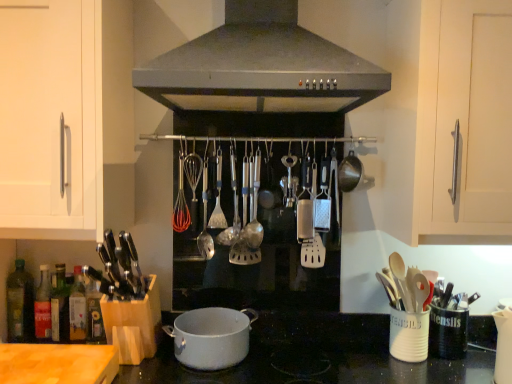
Question: Is silver metallic spoon at center, the third utensil viewed from the right, next to white ceramic utensil holder at lower right and touching it?

Choices:
 (A) yes
 (B) no

Answer: (B)

Question: Does silver metallic spoon at center, which appears as the first utensil when viewed from the left, come behind white ceramic utensil holder at lower right?

Choices:
 (A) yes
 (B) no

Answer: (A)

Question: Is silver metallic spoon at center, the third utensil viewed from the right, thinner than white ceramic utensil holder at lower right?

Choices:
 (A) no
 (B) yes

Answer: (B)

Question: Is silver metallic spoon at center, which appears as the first utensil when viewed from the left, looking in the opposite direction of white ceramic utensil holder at lower right?

Choices:
 (A) yes
 (B) no

Answer: (B)

Question: Is the depth of silver metallic spoon at center, the third utensil viewed from the right, less than that of white ceramic utensil holder at lower right?

Choices:
 (A) yes
 (B) no

Answer: (B)

Question: From a real-world perspective, is white ceramic utensil holder at lower right physically located above or below green glass bottle at lower left?

Choices:
 (A) above
 (B) below

Answer: (B)

Question: Choose the correct answer: Is white ceramic utensil holder at lower right inside green glass bottle at lower left or outside it?

Choices:
 (A) inside
 (B) outside

Answer: (B)

Question: In the image, is white ceramic utensil holder at lower right positioned in front of or behind green glass bottle at lower left?

Choices:
 (A) behind
 (B) front

Answer: (B)

Question: From the image's perspective, is white ceramic utensil holder at lower right above or below green glass bottle at lower left?

Choices:
 (A) above
 (B) below

Answer: (B)

Question: In the image, is wooden cutting board at lower left on the left side or the right side of white ceramic utensil holder at lower right?

Choices:
 (A) right
 (B) left

Answer: (B)

Question: From their relative heights in the image, would you say wooden cutting board at lower left is taller or shorter than white ceramic utensil holder at lower right?

Choices:
 (A) short
 (B) tall

Answer: (A)

Question: Is point (66, 367) closer or farther from the camera than point (413, 342)?

Choices:
 (A) farther
 (B) closer

Answer: (B)

Question: Choose the correct answer: Is wooden cutting board at lower left inside white ceramic utensil holder at lower right or outside it?

Choices:
 (A) inside
 (B) outside

Answer: (B)

Question: Considering their positions, is wooden cutting board at lower left located in front of or behind silver metallic spoon at center, which appears as the first utensil when viewed from the left?

Choices:
 (A) behind
 (B) front

Answer: (B)

Question: Is wooden cutting board at lower left bigger or smaller than silver metallic spoon at center, the third utensil viewed from the right?

Choices:
 (A) small
 (B) big

Answer: (B)